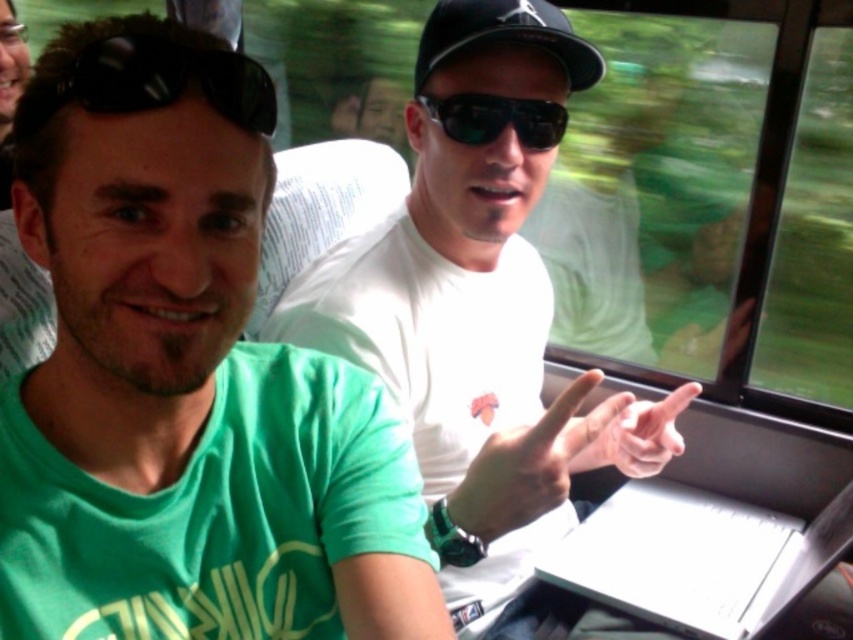
Question: Where is white glossy laptop at center located in relation to sunglasses at center in the image?

Choices:
 (A) left
 (B) right

Answer: (B)

Question: Which of these objects is positioned farthest from the black matte baseball cap at center?

Choices:
 (A) white matte shirt at center
 (B) sunglasses at center
 (C) black matte sunglasses at upper left
 (D) green matte t-shirt at left

Answer: (D)

Question: Does white glossy laptop at center have a lesser width compared to black matte sunglasses at upper left?

Choices:
 (A) no
 (B) yes

Answer: (A)

Question: Which of the following is the closest to the observer?

Choices:
 (A) (844, 529)
 (B) (486, 10)
 (C) (322, 355)

Answer: (C)

Question: Can you confirm if white matte shirt at center is wider than white glossy laptop at center?

Choices:
 (A) yes
 (B) no

Answer: (A)

Question: Which object appears farthest from the camera in this image?

Choices:
 (A) sunglasses at center
 (B) black matte sunglasses at upper left

Answer: (A)